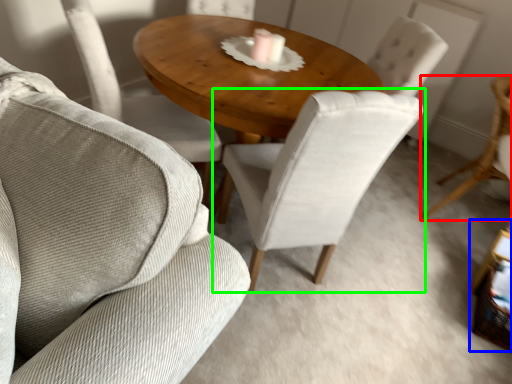
Question: Which object is positioned closest to chair (highlighted by a red box)? Select from side table (highlighted by a blue box) and chair (highlighted by a green box).

Choices:
 (A) side table
 (B) chair

Answer: (A)